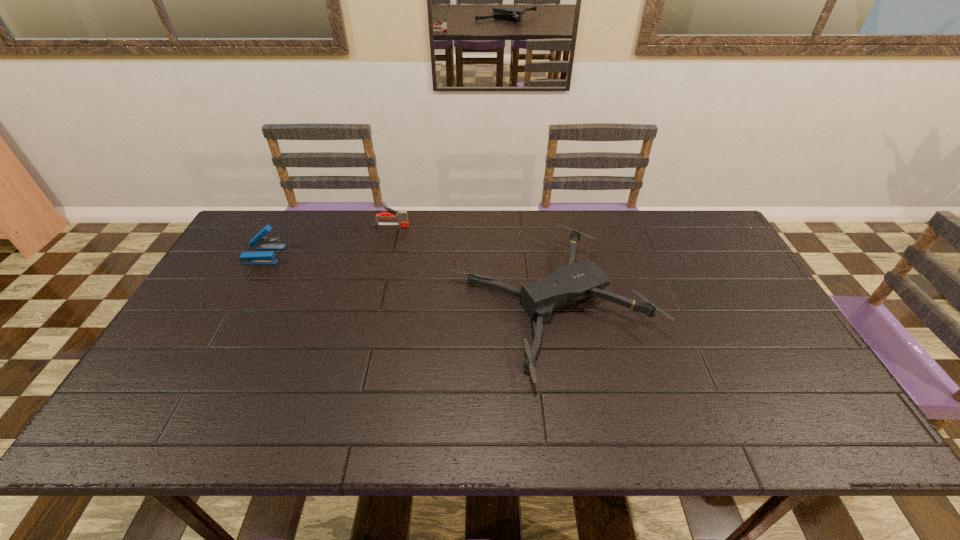
I want to click on vacant position in the image that satisfies the following two spatial constraints: 1. on the handle side of the farthest object; 2. on the left side of the drone, so coord(372,306).

Image resolution: width=960 pixels, height=540 pixels. What are the coordinates of `vacant region that satisfies the following two spatial constraints: 1. on the back side of the rightmost object; 2. on the handle side of the right stapler` in the screenshot? It's located at (538, 225).

Image resolution: width=960 pixels, height=540 pixels. I want to click on vacant area that satisfies the following two spatial constraints: 1. on the handle side of the drone; 2. on the left side of the second object from left to right, so click(372, 306).